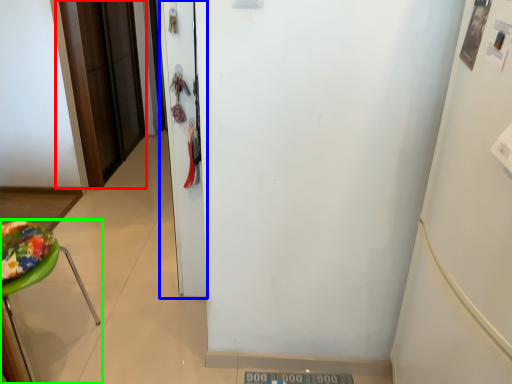
Question: Based on their relative distances, which object is nearer to door (highlighted by a red box)? Choose from door (highlighted by a blue box) and furniture (highlighted by a green box).

Choices:
 (A) door
 (B) furniture

Answer: (A)